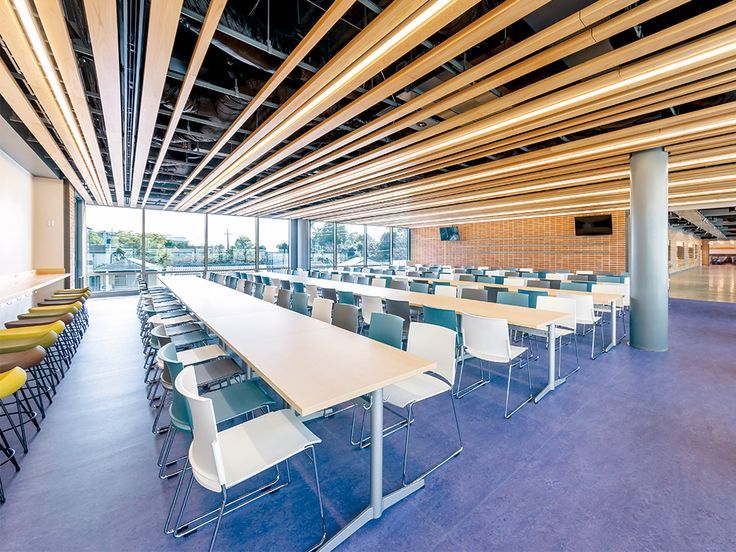
In order to click on bar stools in this screenshot , I will do `click(13, 378)`, `click(28, 353)`, `click(35, 338)`, `click(46, 318)`, `click(54, 309)`, `click(57, 305)`, `click(66, 302)`, `click(68, 296)`, `click(73, 286)`.